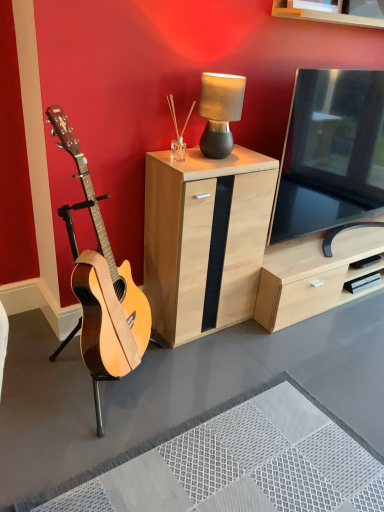
Question: From the image's perspective, is light wood/black panel cabinet at center under natural wood guitar at left?

Choices:
 (A) yes
 (B) no

Answer: (B)

Question: Is the position of light wood/black panel cabinet at center more distant than that of natural wood guitar at left?

Choices:
 (A) yes
 (B) no

Answer: (A)

Question: Is light wood/black panel cabinet at center at the right side of natural wood guitar at left?

Choices:
 (A) yes
 (B) no

Answer: (A)

Question: Considering the relative sizes of light wood/black panel cabinet at center and natural wood guitar at left in the image provided, is light wood/black panel cabinet at center bigger than natural wood guitar at left?

Choices:
 (A) yes
 (B) no

Answer: (B)

Question: From the image's perspective, would you say light wood/black panel cabinet at center is positioned over natural wood guitar at left?

Choices:
 (A) no
 (B) yes

Answer: (B)

Question: Can you confirm if light wood/black panel cabinet at center is shorter than natural wood guitar at left?

Choices:
 (A) yes
 (B) no

Answer: (A)

Question: Is natural wood guitar at left to the left of light wood/black panel cabinet at center from the viewer's perspective?

Choices:
 (A) yes
 (B) no

Answer: (A)

Question: Is natural wood guitar at left oriented away from light wood/black panel cabinet at center?

Choices:
 (A) yes
 (B) no

Answer: (B)

Question: Considering the relative sizes of natural wood guitar at left and light wood/black panel cabinet at center in the image provided, is natural wood guitar at left wider than light wood/black panel cabinet at center?

Choices:
 (A) yes
 (B) no

Answer: (A)

Question: Can you confirm if natural wood guitar at left is bigger than light wood/black panel cabinet at center?

Choices:
 (A) yes
 (B) no

Answer: (A)

Question: From a real-world perspective, does natural wood guitar at left stand above light wood/black panel cabinet at center?

Choices:
 (A) yes
 (B) no

Answer: (A)

Question: Is light wood/black panel cabinet at center a part of natural wood guitar at left?

Choices:
 (A) yes
 (B) no

Answer: (B)

Question: Can you confirm if matte black lamp at upper center is taller than light wood/black panel cabinet at center?

Choices:
 (A) yes
 (B) no

Answer: (B)